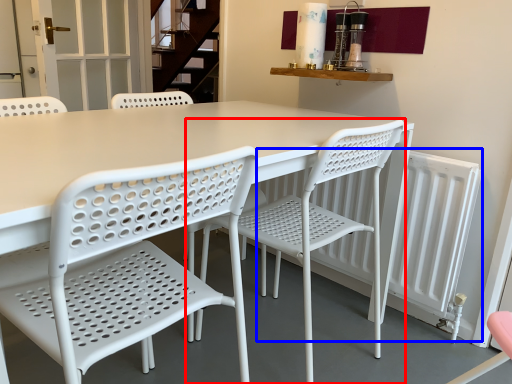
Question: Which object appears closest to the camera in this image, chair (highlighted by a red box) or radiator (highlighted by a blue box)?

Choices:
 (A) chair
 (B) radiator

Answer: (A)